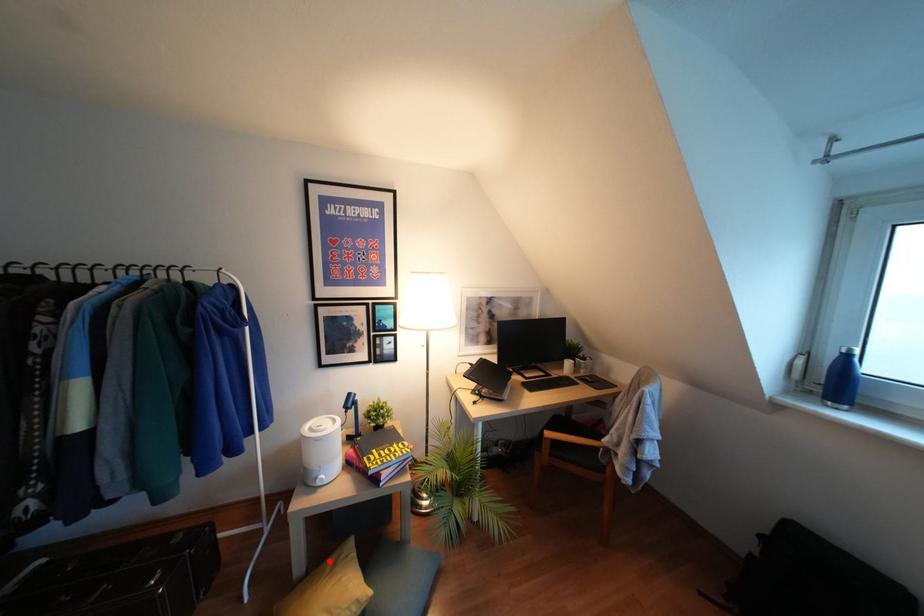
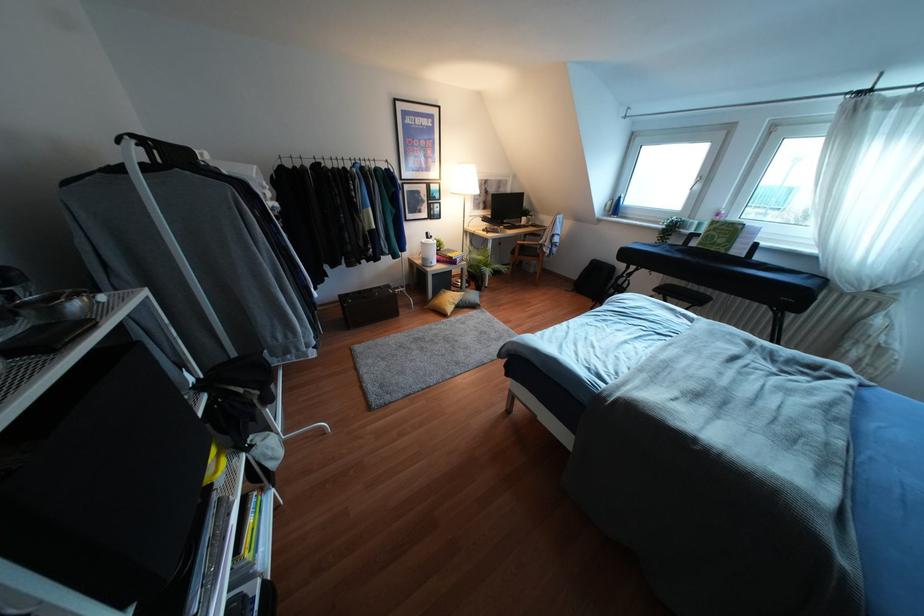
Find the pixel in the second image that matches the highlighted location in the first image.

(441, 292)